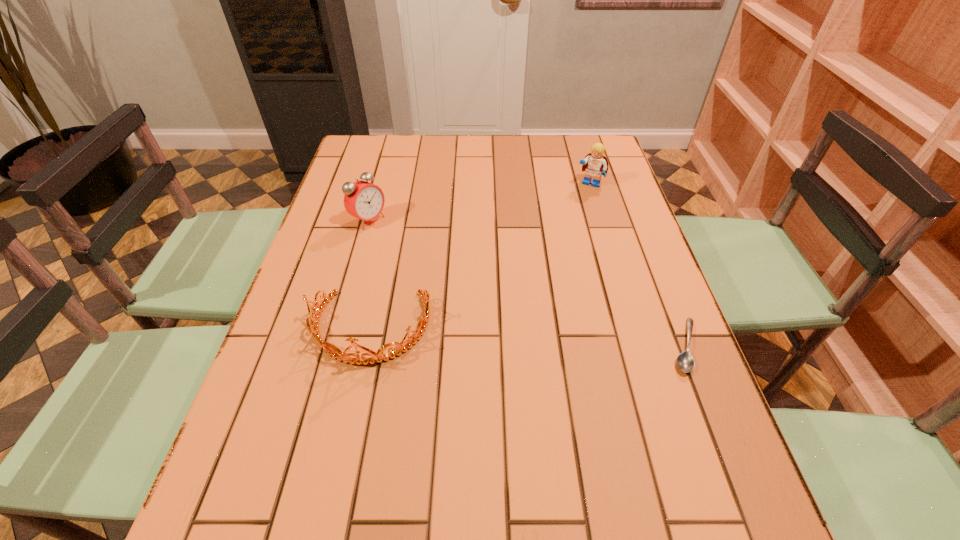
Identify the location of blank region between the third tallest object and the shortest object. This screenshot has width=960, height=540. click(x=528, y=337).

Where is `empty space between the Lego and the third tallest object`? The image size is (960, 540). empty space between the Lego and the third tallest object is located at coordinates (480, 256).

Find the location of a particular element. free space between the alarm clock and the Lego is located at coordinates (479, 202).

What are the coordinates of `free spot between the rightmost object and the alarm clock` in the screenshot? It's located at (527, 283).

The image size is (960, 540). I want to click on unoccupied position between the second shortest object and the rightmost object, so click(528, 337).

Locate which object ranks second in proximity to the third tallest object. Please provide its 2D coordinates. Your answer should be formatted as a tuple, i.e. [(x, y)], where the tuple contains the x and y coordinates of a point satisfying the conditions above.

[(685, 361)]

Image resolution: width=960 pixels, height=540 pixels. What are the coordinates of `object that is the third nearest to the alarm clock` in the screenshot? It's located at (685, 361).

This screenshot has width=960, height=540. In order to click on free region that satisfies the following two spatial constraints: 1. on the front-facing side of the second shortest object; 2. on the right side of the rightmost object in this screenshot , I will do `click(367, 346)`.